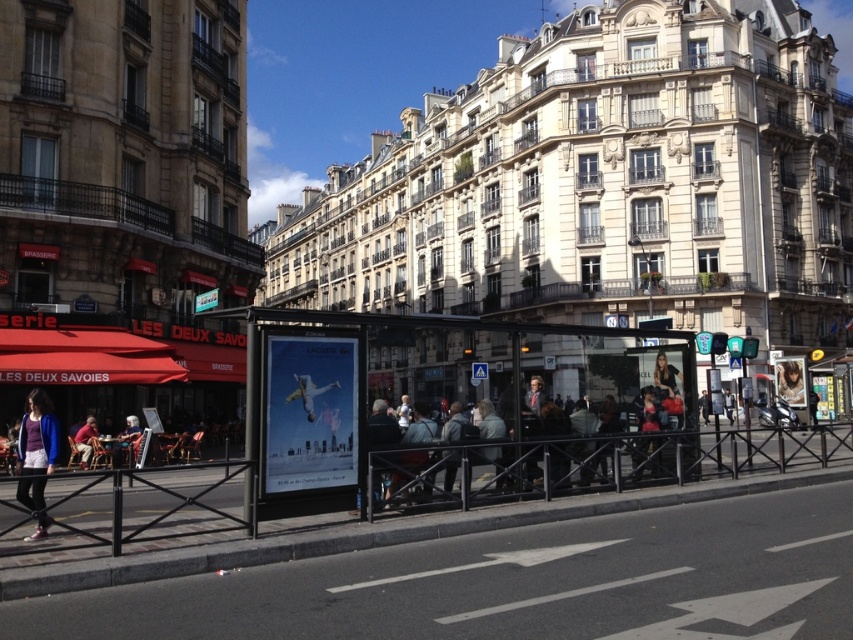
You are a pedestrian standing on the sidewalk looking at the transparent glass bus stop at center and the dark blue jeans at center. Which object is positioned to the right of the other?

The transparent glass bus stop at center is to the right of dark blue jeans at center.

You are a pedestrian standing on the sidewalk and see the transparent glass bus stop at center and the dark blue jeans at center. Which object is closer to your feet?

The dark blue jeans at center are closer to your feet because the transparent glass bus stop at center is located above them according to the description.